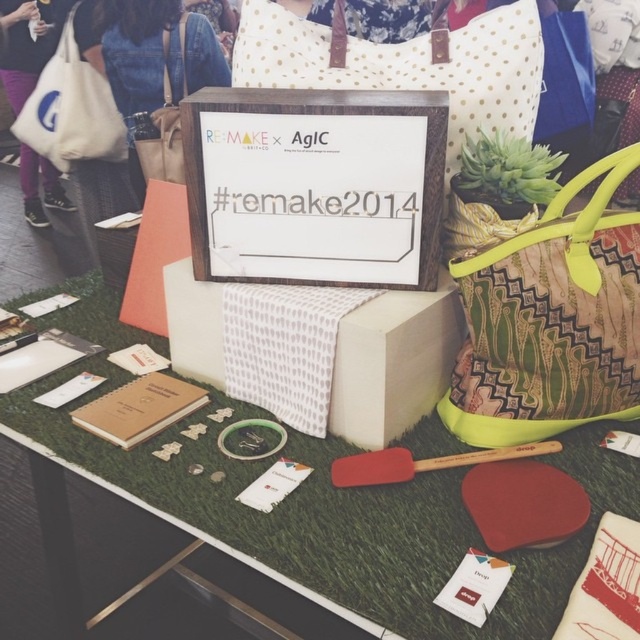
You are setting up a small display for an eco exhibition and have a white dotted pillow at upper center and a matte beige tote at upper left. You need to place a rectangular sign that is 20 cm wide between them. Can the space between the two items accommodate the sign?

The white dotted pillow at upper center is wider than the matte beige tote at upper left. However, without knowing the exact distance between them, it is impossible to determine if the 20 cm sign will fit. Please measure the space between the two items first.

You are organizing a recycling fair and need to choose a bag to carry promotional materials. The green patterned fabric bag at center and the white canvas tote at upper left are available. Which bag has a greater capacity for holding items?

The white canvas tote at upper left has a greater capacity because it is thicker than the green patterned fabric bag at center.

In the scene shown: You are organizing a small fair booth and need to choose a bag to display a collection of handmade items. The items are of varying sizes, including some taller pieces. Considering the green patterned fabric bag at center and the matte beige tote at upper left, which bag would be more suitable for displaying taller items?

The green patterned fabric bag at center has a greater height compared to the matte beige tote at upper left, making it more suitable for displaying taller items.